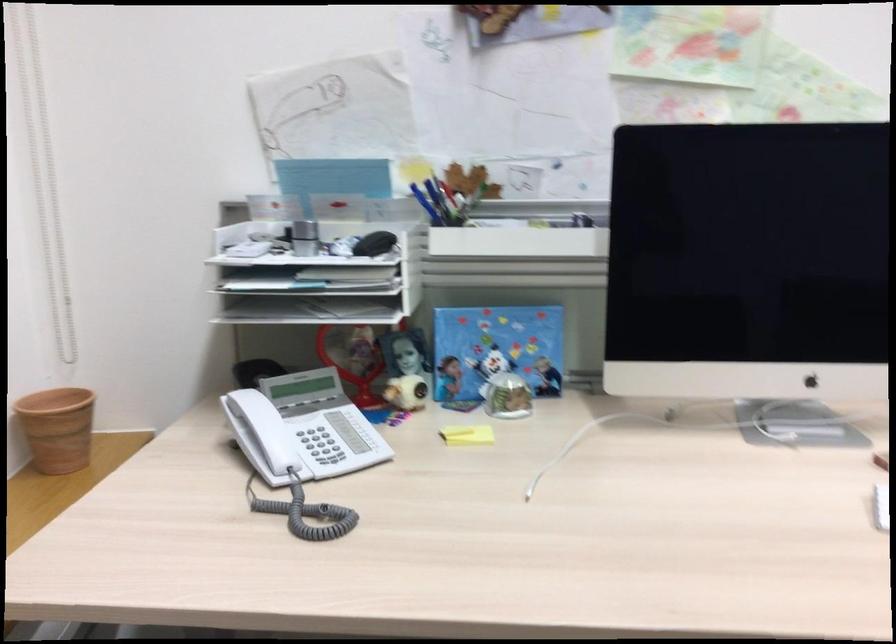
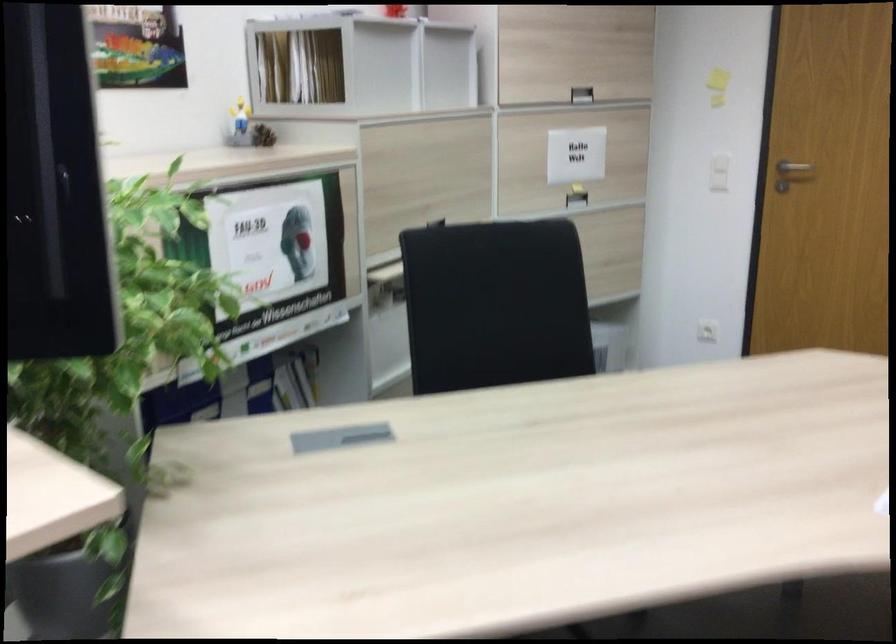
Question: How did the camera likely rotate?

Choices:
 (A) Left
 (B) Right
 (C) Up
 (D) Down

Answer: (B)